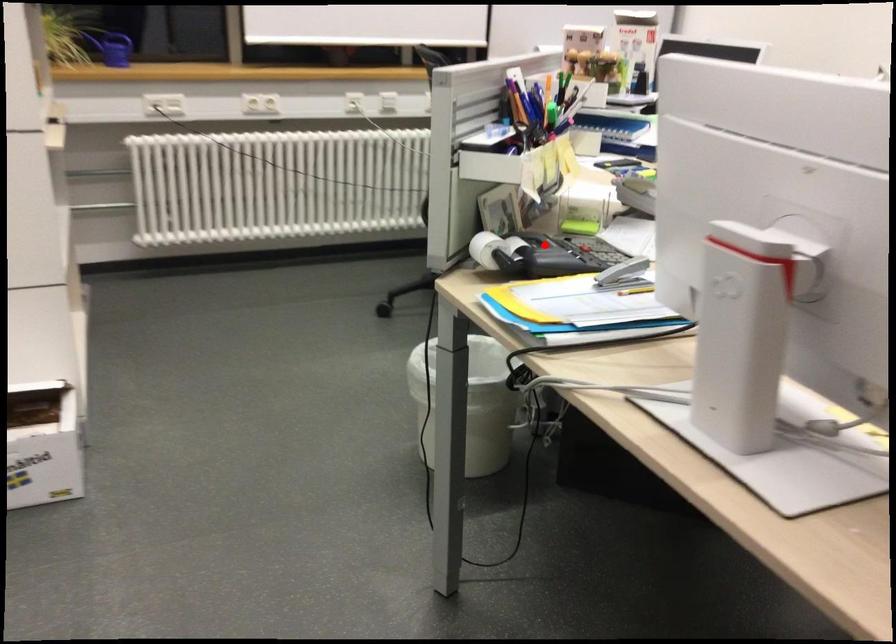
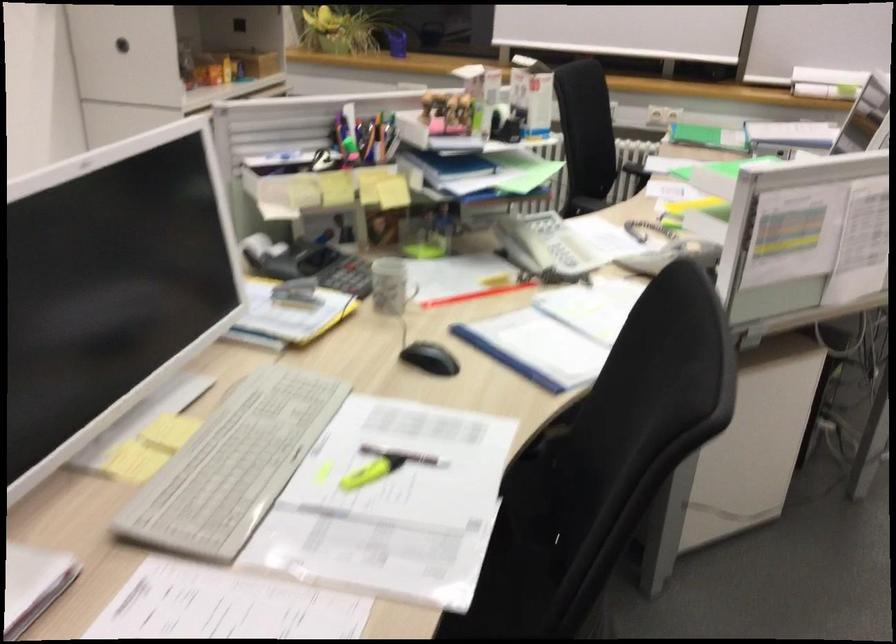
The point at the highlighted location is marked in the first image. Where is the corresponding point in the second image?

(286, 257)